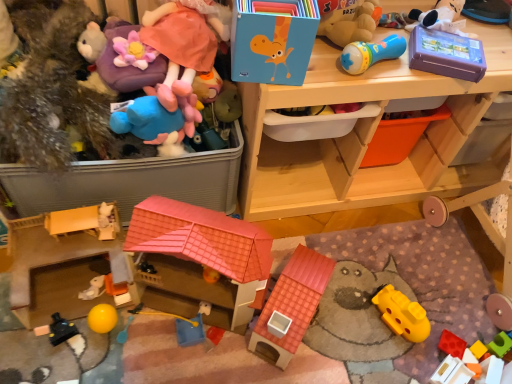
You are a GUI agent. You are given a task and a screenshot of the screen. Output one action in this format:
    pyautogui.click(x=<x>, y=<y>)
    Task: Click on the vacant area that lies in front of black plastic toy at lower left, positioned as the 2th toy in left-to-right order
    The image size is (512, 384).
    Given the screenshot: What is the action you would take?
    pyautogui.click(x=46, y=365)